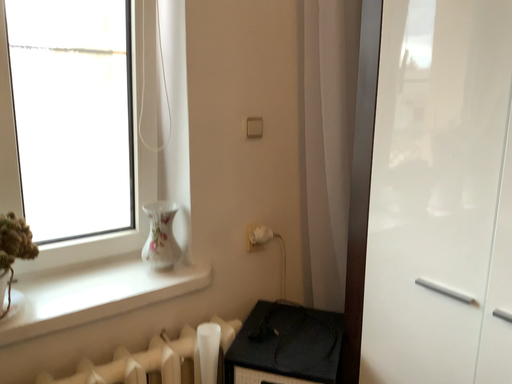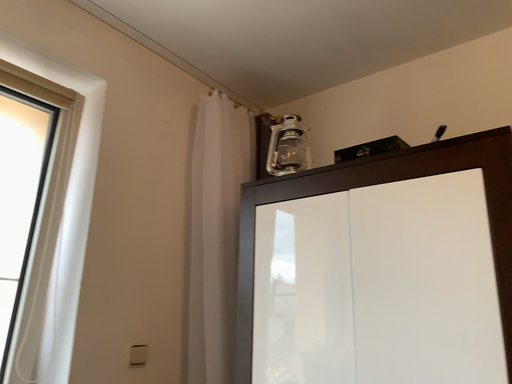
Question: How did the camera likely rotate when shooting the video?

Choices:
 (A) rotated downward
 (B) rotated upward

Answer: (B)